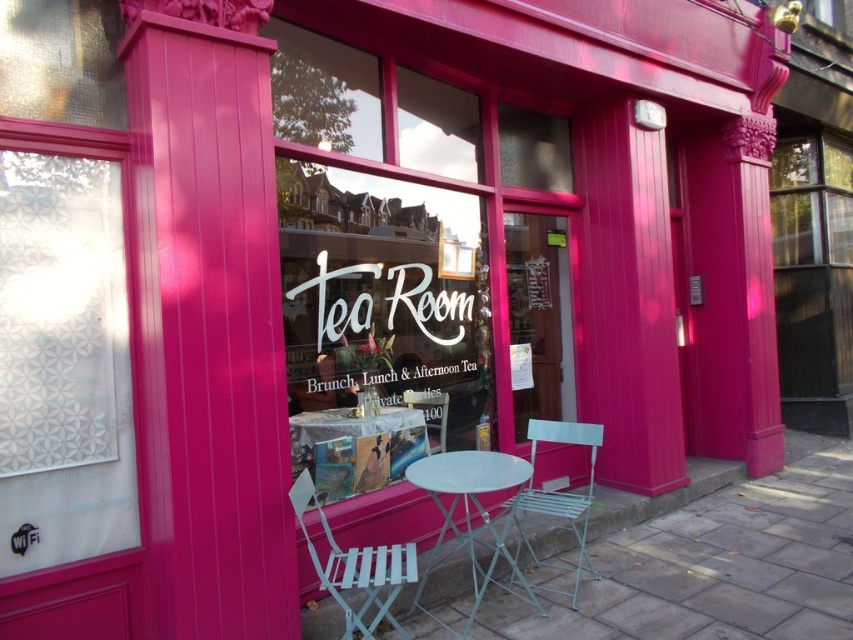
You are a customer entering the tea room and want to sit down at the metallic silver table at center. Which direction should you walk relative to the metallic silver chair at center?

The metallic silver table at center is in front of the metallic silver chair at center, so you should walk forward towards the metallic silver table at center to sit down.

Consider the image. You are a customer standing outside the tea room looking through the entrance window. You see a transparent paper at upper left and a white plastic table at center. Which object is closer to you?

The transparent paper at upper left is closer to the viewer than the white plastic table at center.